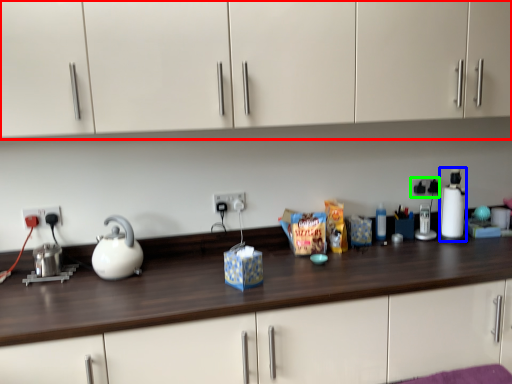
Question: Based on their relative distances, which object is farther from cabinetry (highlighted by a red box)? Choose from blender (highlighted by a blue box) and electric outlet (highlighted by a green box).

Choices:
 (A) blender
 (B) electric outlet

Answer: (B)